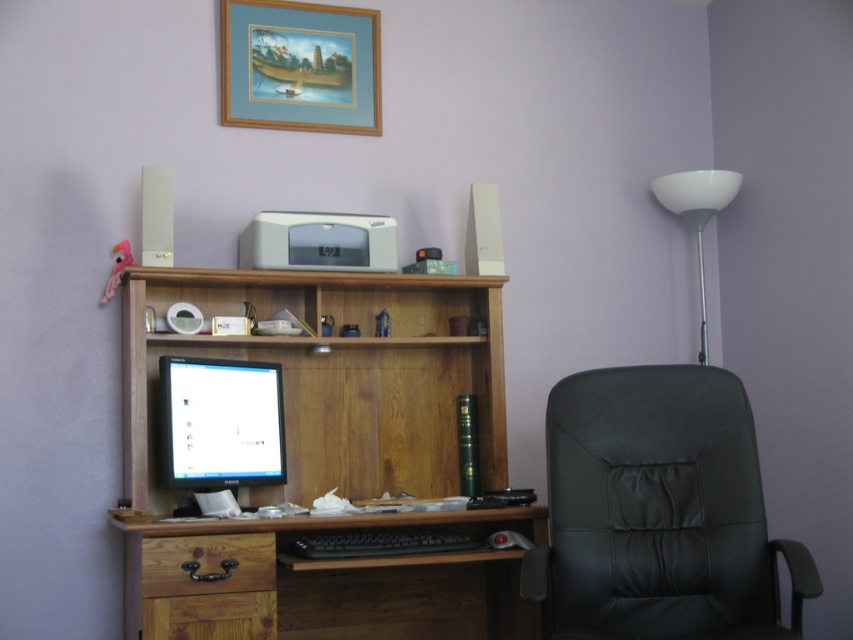
Consider the image. You are standing in front of the home office desk and want to reach two points marked on the desk surface. The first point is at coordinate point (717,460) and the second is at point (300,605). Which point is closer to you?

Point (717,460) is closer to the camera than point (300,605), so the first point is closer to you.

You are standing in the home office and want to hang a new painting that requires a 3.5 meter reach. Is the gold wooden picture frame at upper center within your reach?

The gold wooden picture frame at upper center is 3.39 meters away from the viewer, so it is within reach for hanging the new painting since 3.39 meters is less than 3.5 meters.

You are sitting in the black leather swivel chair at right and want to reach the wooden computer at center. Can you easily access it from your current position?

The black leather swivel chair at right is in front of the wooden computer at center, so you can easily access it by moving forward in the chair.